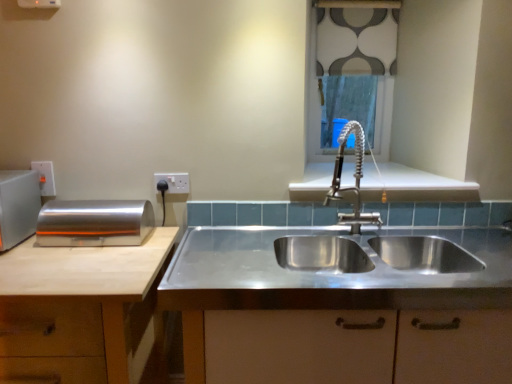
Question: Choose the correct answer: Is patterned fabric at upper center inside white plastic electric outlet at upper left, the second electric outlet from the right, or outside it?

Choices:
 (A) outside
 (B) inside

Answer: (A)

Question: Does point (386, 23) appear closer or farther from the camera than point (44, 178)?

Choices:
 (A) closer
 (B) farther

Answer: (B)

Question: Which of these objects is positioned closest to the satin nickel faucet at center?

Choices:
 (A) patterned fabric at upper center
 (B) stainless steel sink at center
 (C) stainless steel sink at center
 (D) white plastic electric outlet at upper left, the first electric outlet from the left
 (E) light brown wood cabinet at left

Answer: (C)

Question: Which of these objects is positioned farthest from the patterned fabric at upper center?

Choices:
 (A) light brown wood cabinet at left
 (B) stainless steel sink at center
 (C) white plastic electric outlet at upper center, marked as the first electric outlet in a right-to-left arrangement
 (D) satin nickel faucet at center
 (E) silver metallic breadbox at left, acting as the second appliance starting from the left

Answer: (A)